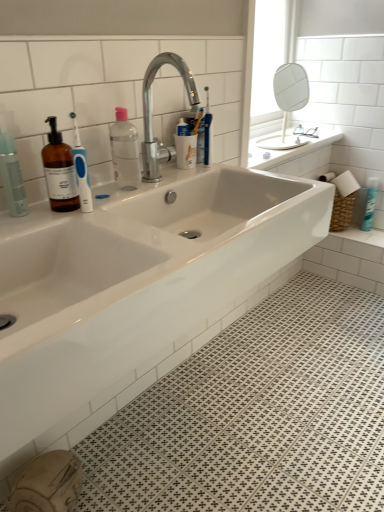
The image size is (384, 512). I want to click on vacant point to the right of transparent plastic bottle at center, so click(x=177, y=181).